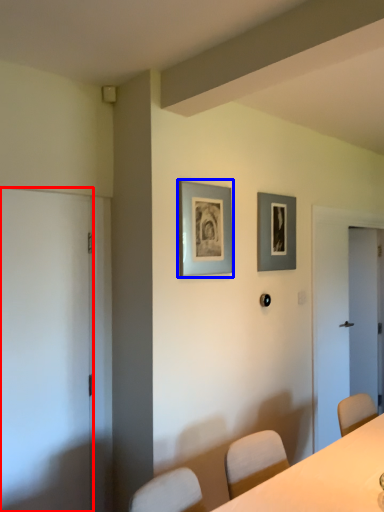
Question: Which object is further to the camera taking this photo, door (highlighted by a red box) or picture frame (highlighted by a blue box)?

Choices:
 (A) door
 (B) picture frame

Answer: (B)